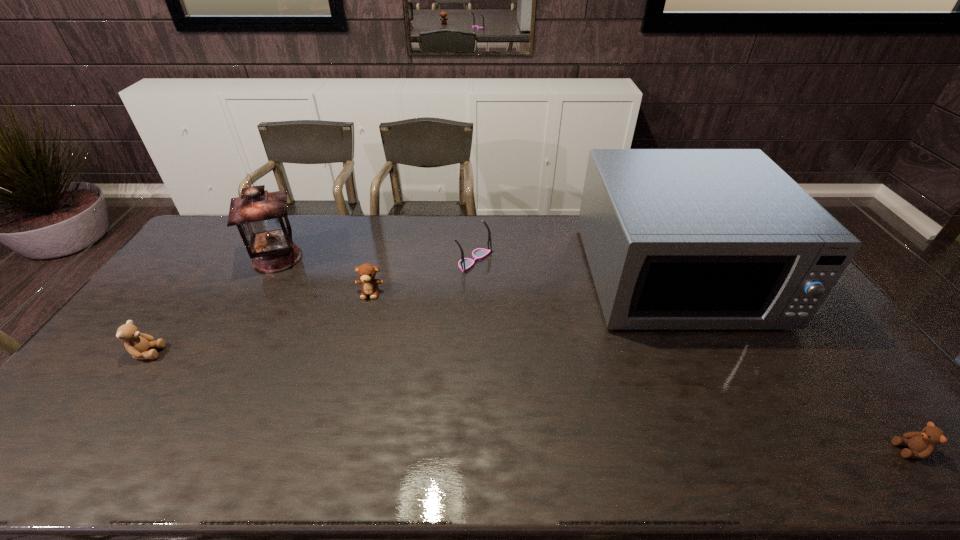
Locate an element on the screen. The height and width of the screenshot is (540, 960). free space between the shortest object and the fourth object from right to left is located at coordinates (640, 372).

Find the location of a particular element. vacant space in between the nearest teddy bear and the third object from right to left is located at coordinates (692, 355).

The width and height of the screenshot is (960, 540). In order to click on free space between the microwave oven and the spectacles in this screenshot , I will do (575, 268).

Where is `vacant area that lies between the second nearest teddy bear and the rightmost object`? The width and height of the screenshot is (960, 540). vacant area that lies between the second nearest teddy bear and the rightmost object is located at coordinates (529, 401).

The height and width of the screenshot is (540, 960). Find the location of `free space between the nearest teddy bear and the leftmost object`. free space between the nearest teddy bear and the leftmost object is located at coordinates 529,401.

Where is `free space between the second object from left to right and the second teddy bear from left to right`? The image size is (960, 540). free space between the second object from left to right and the second teddy bear from left to right is located at coordinates [324, 275].

Where is `unoccupied position between the spectacles and the second object from right to left`? Image resolution: width=960 pixels, height=540 pixels. unoccupied position between the spectacles and the second object from right to left is located at coordinates (575, 268).

Image resolution: width=960 pixels, height=540 pixels. I want to click on free space between the oil lamp and the spectacles, so click(376, 259).

Where is `free spot between the farthest teddy bear and the oil lamp`? This screenshot has height=540, width=960. free spot between the farthest teddy bear and the oil lamp is located at coordinates 324,275.

Locate an element on the screen. The image size is (960, 540). the closest object to the second teddy bear from left to right is located at coordinates point(261,217).